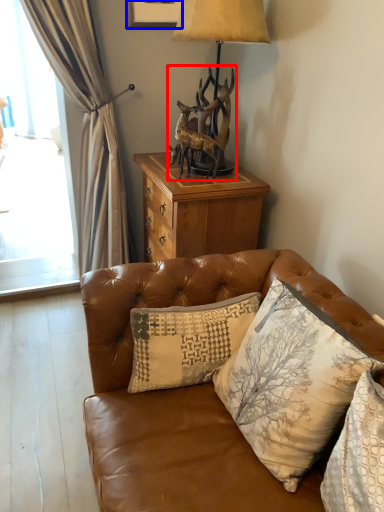
Question: Which object appears farthest to the camera in this image, animal (highlighted by a red box) or picture frame (highlighted by a blue box)?

Choices:
 (A) animal
 (B) picture frame

Answer: (B)